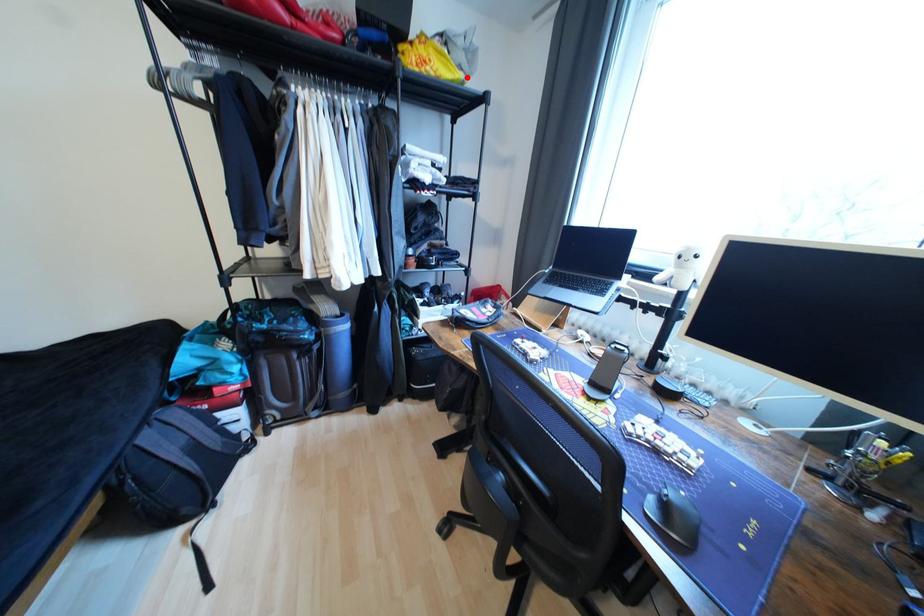
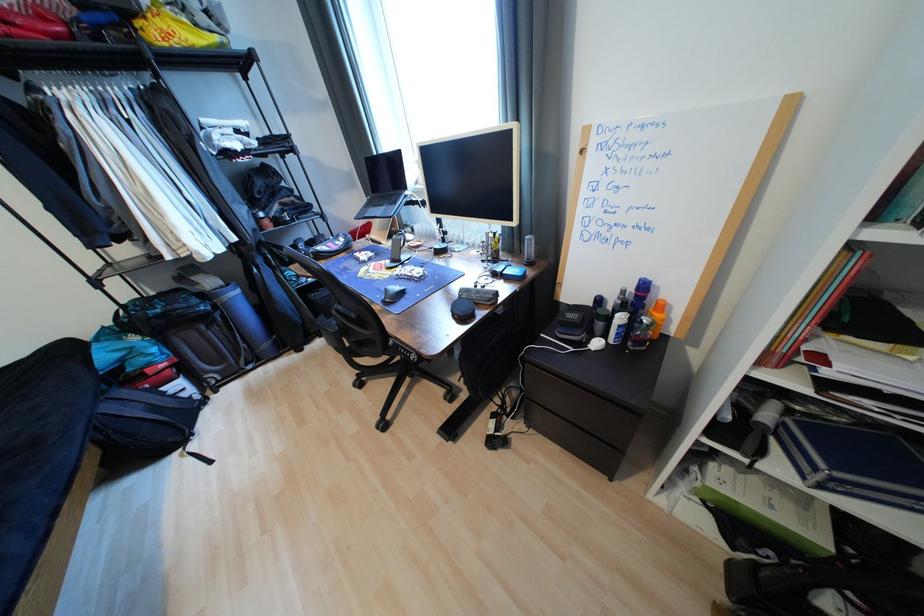
Find the pixel in the second image that matches the highlighted location in the first image.

(223, 39)